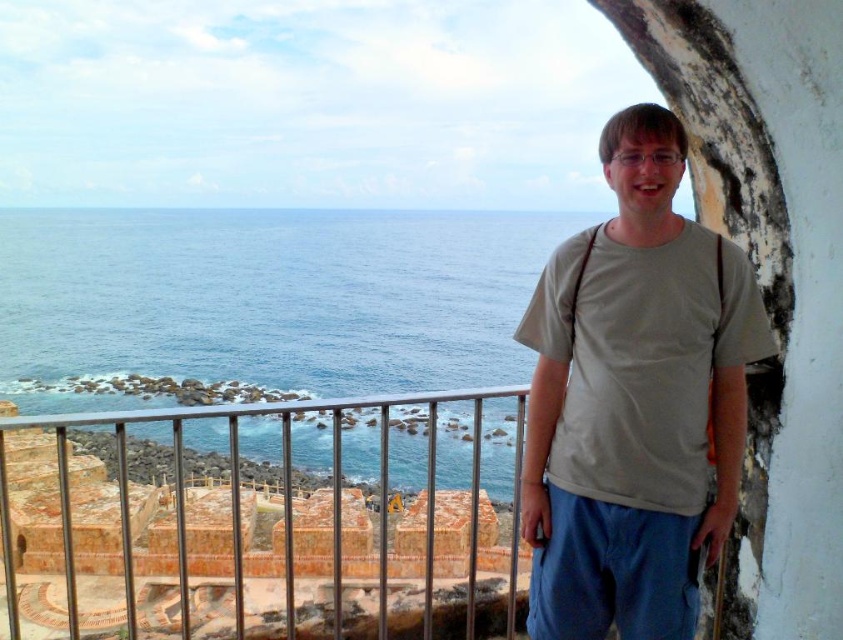
Question: Which of the following is the farthest from the observer?

Choices:
 (A) gray cotton t-shirt at right
 (B) metal/rustic rail at lower left

Answer: (B)

Question: Does metal/rustic rail at lower left have a larger size compared to gray cotton t-shirt at right?

Choices:
 (A) yes
 (B) no

Answer: (A)

Question: Does metal/rustic rail at lower left appear over gray cotton t-shirt at right?

Choices:
 (A) yes
 (B) no

Answer: (B)

Question: Is metal/rustic rail at lower left to the left of gray cotton t-shirt at right from the viewer's perspective?

Choices:
 (A) yes
 (B) no

Answer: (A)